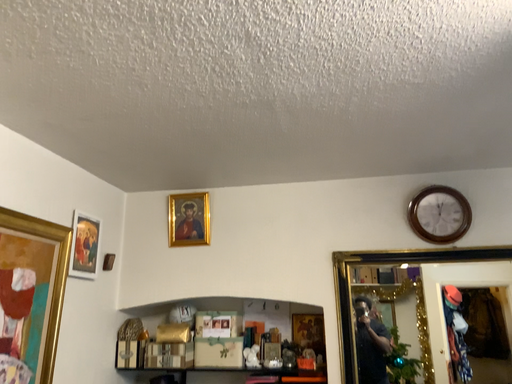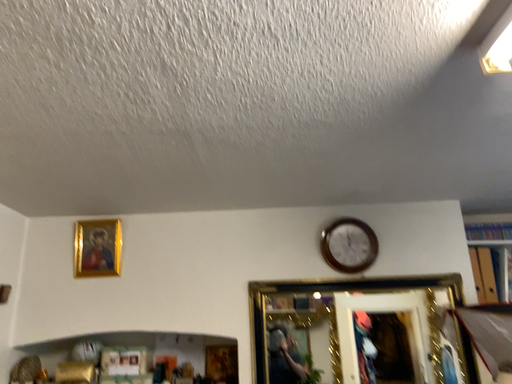
Question: Which way did the camera rotate in the video?

Choices:
 (A) rotated right
 (B) rotated left

Answer: (A)